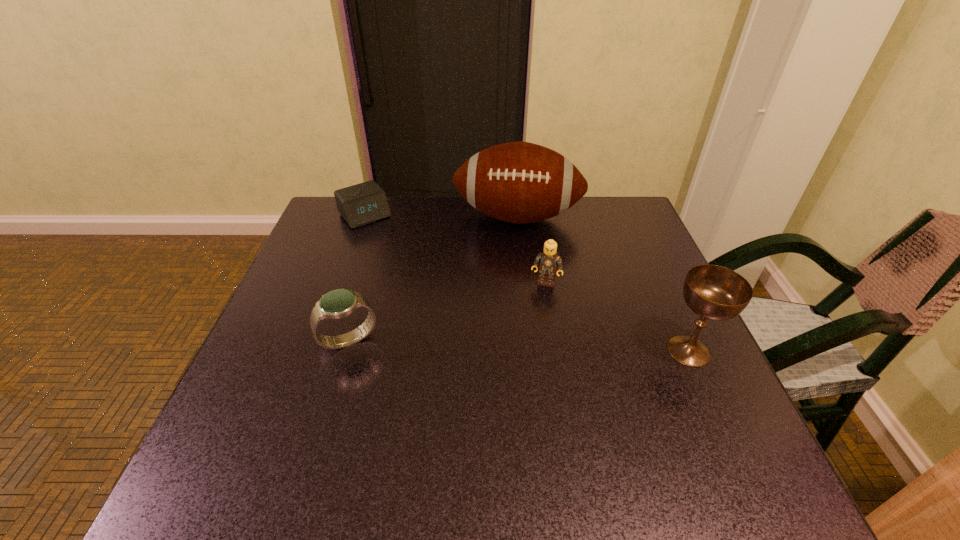
Locate an element on the screen. The width and height of the screenshot is (960, 540). empty space that is in between the watch and the shortest object is located at coordinates (357, 278).

Where is `free point between the second tallest object and the watch`? This screenshot has height=540, width=960. free point between the second tallest object and the watch is located at coordinates (x=518, y=346).

Where is `empty space that is in between the football and the watch`? The width and height of the screenshot is (960, 540). empty space that is in between the football and the watch is located at coordinates (433, 279).

At what (x,y) coordinates should I click in order to perform the action: click on free space between the watch and the rightmost object. Please return your answer as a coordinate pair (x, y). The width and height of the screenshot is (960, 540). Looking at the image, I should click on (518, 346).

At what (x,y) coordinates should I click in order to perform the action: click on vacant space in between the third farthest object and the tallest object. Please return your answer as a coordinate pair (x, y). This screenshot has height=540, width=960. Looking at the image, I should click on (531, 250).

Identify the location of free space between the third farthest object and the alarm clock. This screenshot has width=960, height=540. (455, 249).

Identify the location of vacant point located between the watch and the rightmost object. (518, 346).

Identify the location of empty location between the alarm clock and the fourth shortest object. Image resolution: width=960 pixels, height=540 pixels. (527, 283).

Locate an element on the screen. vacant space in between the fourth shortest object and the Lego is located at coordinates (617, 317).

Identify which object is the third closest to the tallest object. Please provide its 2D coordinates. Your answer should be formatted as a tuple, i.e. [(x, y)], where the tuple contains the x and y coordinates of a point satisfying the conditions above.

[(713, 292)]